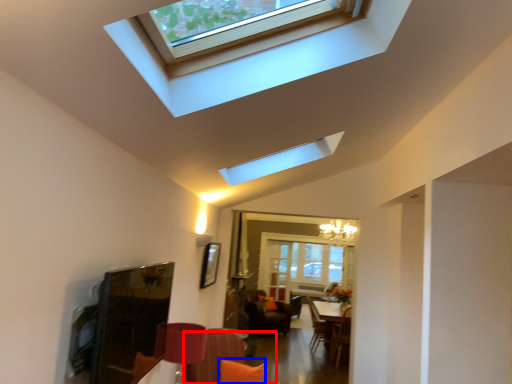
Question: Which object appears farthest to the camera in this image, couch (highlighted by a red box) or pillow (highlighted by a blue box)?

Choices:
 (A) couch
 (B) pillow

Answer: (B)